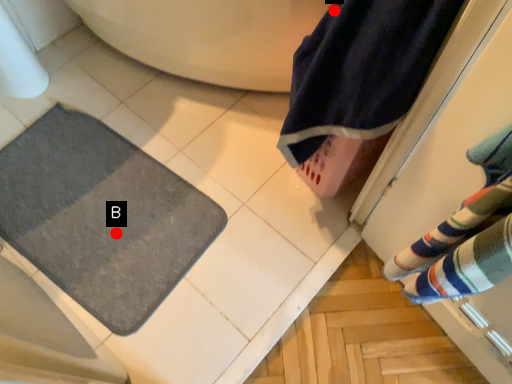
Question: Two points are circled on the image, labeled by A and B beside each circle. Which point is further to the camera?

Choices:
 (A) A is further
 (B) B is further

Answer: (B)